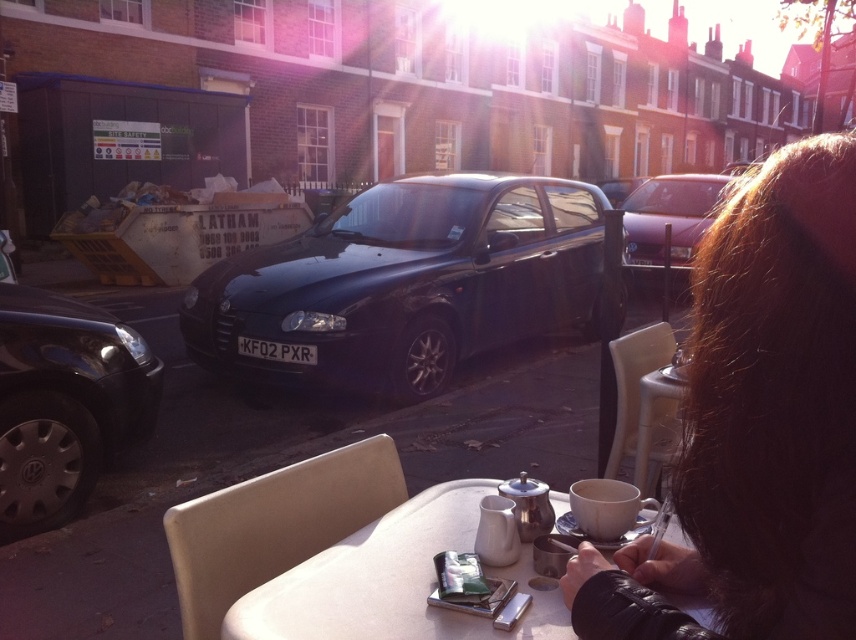
You are a delivery person who needs to deliver a package to the person with dark brown hair at upper right. The delivery vehicle you are driving is a motorcycle with a 2.5 meter turning radius. Can you safely navigate your motorcycle around the metallic purple car at center to reach the person?

The distance between dark brown hair at upper right and metallic purple car at center is 4.41 meters. Since the motorcycle has a turning radius of 2.5 meters, which is less than the distance between them, you can safely navigate around the metallic purple car at center to reach the person with dark brown hair at upper right.